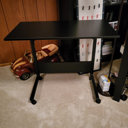
The image size is (128, 128). I want to click on boxes, so click(106, 90), click(104, 82).